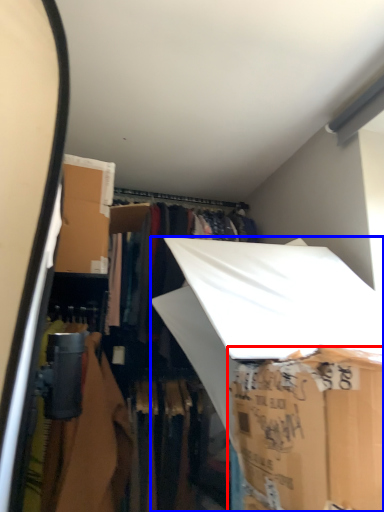
Question: Which object appears closest to the camera in this image, storage box (highlighted by a red box) or storage box (highlighted by a blue box)?

Choices:
 (A) storage box
 (B) storage box

Answer: (A)